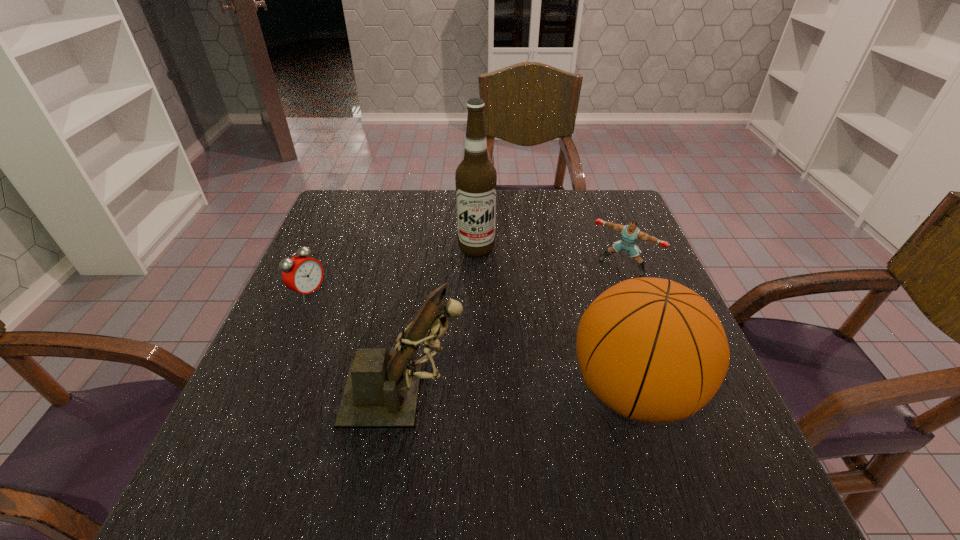
I want to click on basketball located at the right edge, so click(x=653, y=350).

Identify the location of puncher situated at the right edge. point(630,233).

This screenshot has width=960, height=540. Find the location of `object at the near right corner`. object at the near right corner is located at coordinates (653, 350).

Locate an element on the screen. vacant space at the far edge of the desktop is located at coordinates (543, 201).

You are a GUI agent. You are given a task and a screenshot of the screen. Output one action in this format:
    pyautogui.click(x=<x>, y=<y>)
    Task: Click on the vacant space at the near edge of the desktop
    The width and height of the screenshot is (960, 540).
    Given the screenshot: What is the action you would take?
    pyautogui.click(x=458, y=404)

In the image, there is a desktop. Where is `vacant space at the left edge`? This screenshot has width=960, height=540. vacant space at the left edge is located at coordinates (296, 296).

Identify the location of vacant space at the right edge of the desktop. The image size is (960, 540). (612, 261).

The width and height of the screenshot is (960, 540). I want to click on blank space at the far left corner of the desktop, so click(338, 226).

The width and height of the screenshot is (960, 540). In order to click on vacant area at the near left corner in this screenshot , I will do `click(227, 432)`.

At what (x,y) coordinates should I click in order to perform the action: click on vacant space at the far right corner. Please return your answer as a coordinate pair (x, y). The height and width of the screenshot is (540, 960). Looking at the image, I should click on (587, 196).